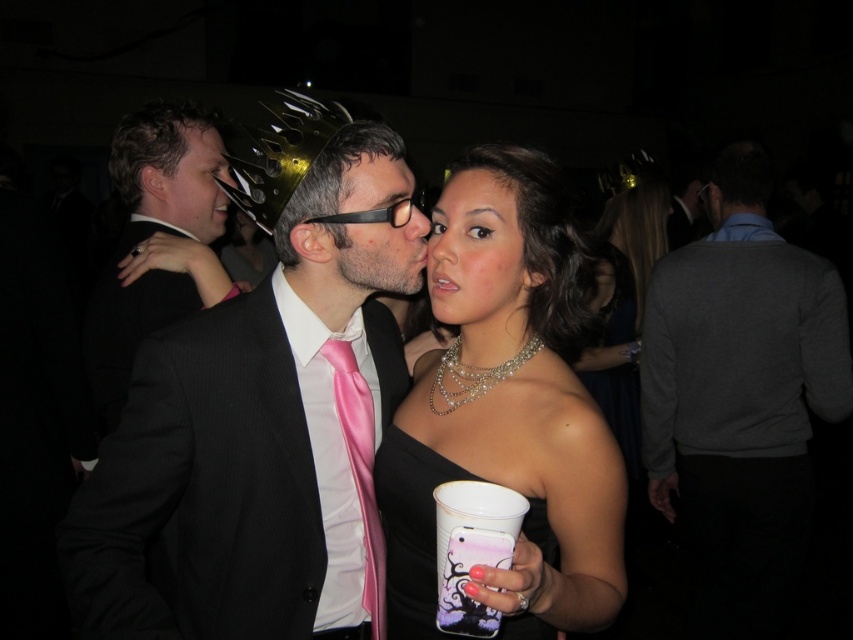
You are at a party and want to find the gray sweater at center. Where would you look based on the coordinates provided?

The gray sweater at center is located at the 2D coordinates point (x=740, y=396).

You are a photographer standing at the camera position. You want to capture a closeup of the gray sweater at center without moving the camera. Is it possible to do so with a standard zoom lens that has a maximum zoom of 10x?

The gray sweater at center is 6.42 feet away from camera. With a standard zoom lens of 10x, it is possible to capture a closeup of the gray sweater at center without moving the camera.